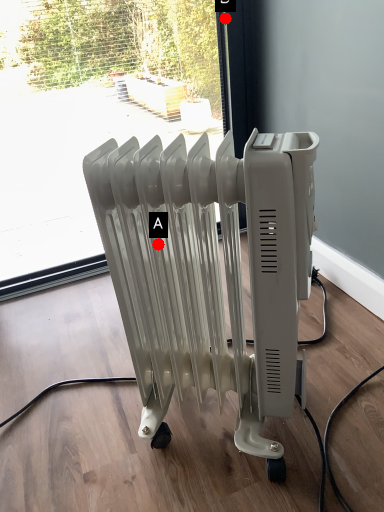
Question: Two points are circled on the image, labeled by A and B beside each circle. Which point is closer to the camera?

Choices:
 (A) A is closer
 (B) B is closer

Answer: (A)